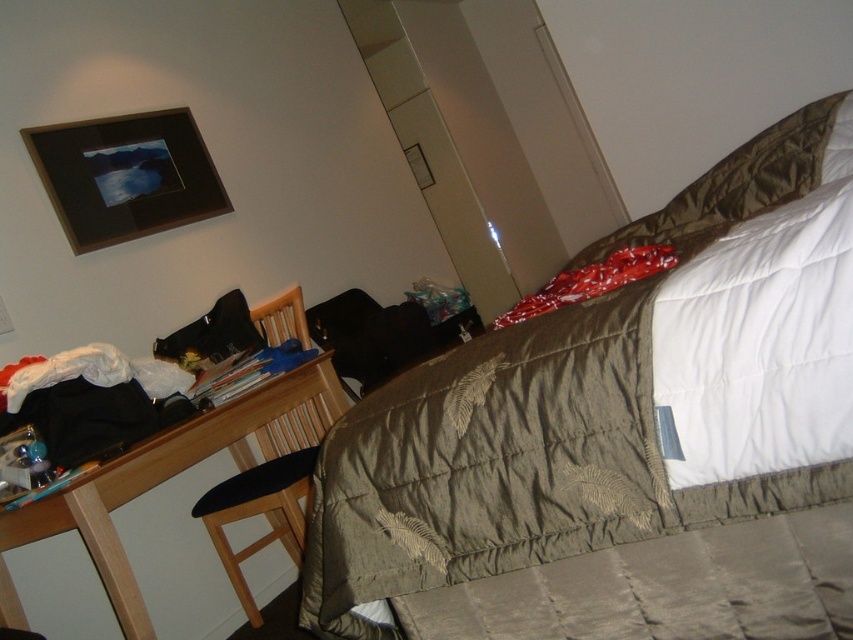
You are trying to rearrange the furniture in the bedroom. If you want to place the wooden chair at center next to the wooden desk at lower left, will there be enough space for both items side by side?

The wooden desk at lower left is wider than the wooden chair at center. Since the desk is already occupying a significant portion of the space, there might not be enough room to place the chair next to it without overcrowding the area. However, if the total available space in the room is sufficient, it could work. The exact answer depends on the room dimensions, which aren

You are trying to clean this bedroom and need to move the wooden desk at lower left to access something behind it. However, the textured olive green comforter at center is blocking the way. Can you move the desk without moving the comforter?

The textured olive green comforter at center is in front of the wooden desk at lower left, meaning the desk is behind the comforter. To move the desk, you would need to first move the comforter out of the way to access it.

What object is located at the coordinates point (154,486) in the bedroom scene?

The wooden desk at lower left is located at point (154,486).